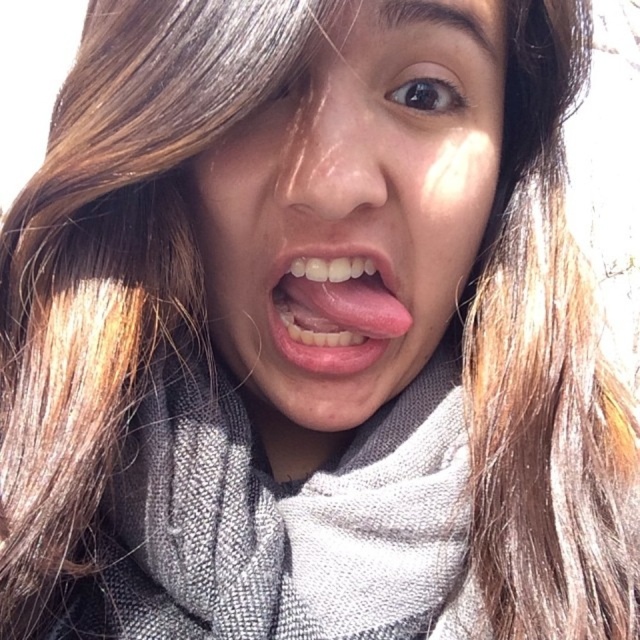
You are a photographer adjusting the focus on your camera. You notice two points in the image at coordinates point (435, 109) and point (440, 625). Which point should you focus on to ensure the subject is sharp if the subject is closer to the camera?

You should focus on point (435, 109) because it is closer to the viewer than point (440, 625), making it the better choice for sharpness when the subject is nearer.

You are a photographer trying to capture a close detail shot of the person in the image. You want to focus on the pink matte tongue at center without the matte gray scarf at center overlapping it. Is the position of the scarf to the left or right of the tongue?

The matte gray scarf at center is positioned on the right side of the pink matte tongue at center, so the scarf is on the right side of the tongue.

You are a photographer trying to decide which scarf to feature in your next shoot. You have two options in front of you, the matte gray scarf at center and the gray knitted scarf at center. Based on the image, which one would you choose if you want the scarf to stand out more in the composition?

The matte gray scarf at center is bigger than the gray knitted scarf at center, so it would stand out more in the composition.